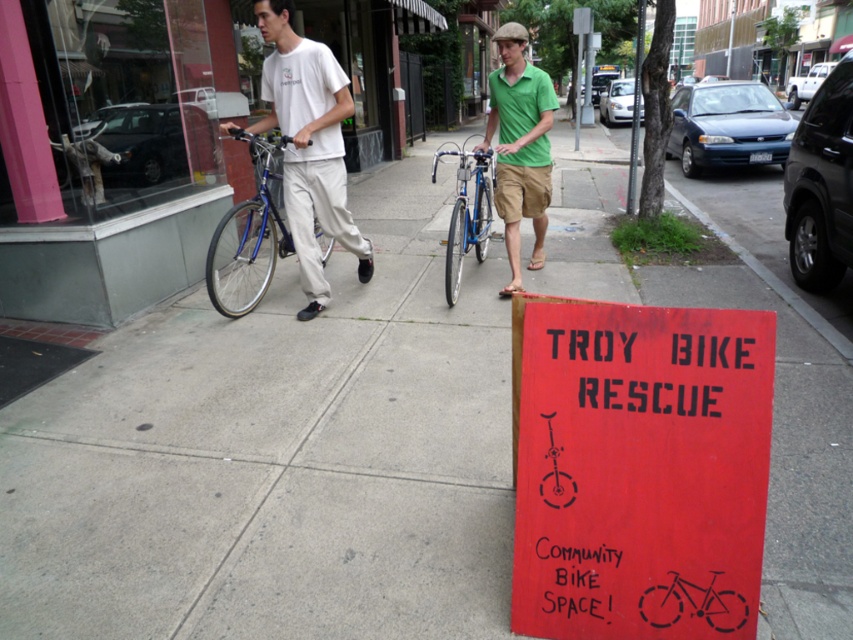
Does point (318, 42) come farther from viewer compared to point (505, 144)?

Yes, it is behind point (505, 144).

In the scene shown: Does white matte t-shirt at center have a lesser width compared to green cotton shirt at center?

No, white matte t-shirt at center is not thinner than green cotton shirt at center.

At what (x,y) coordinates should I click in order to perform the action: click on white matte t-shirt at center. Please return your answer as a coordinate pair (x, y). Looking at the image, I should click on (x=309, y=145).

Find the location of `white matte t-shirt at center`. white matte t-shirt at center is located at coordinates (309, 145).

Which is behind, point (741, 636) or point (453, 228)?

Point (453, 228)

Does point (672, 332) come in front of point (456, 211)?

Yes, it is.

Where is `red wood sign at center`? The image size is (853, 640). red wood sign at center is located at coordinates (637, 468).

Is red wood sign at center bigger than green cotton shirt at center?

Yes.

Is red wood sign at center smaller than green cotton shirt at center?

No.

Is point (592, 384) more distant than point (496, 150)?

No, (592, 384) is closer to viewer.

Identify the location of red wood sign at center. [637, 468].